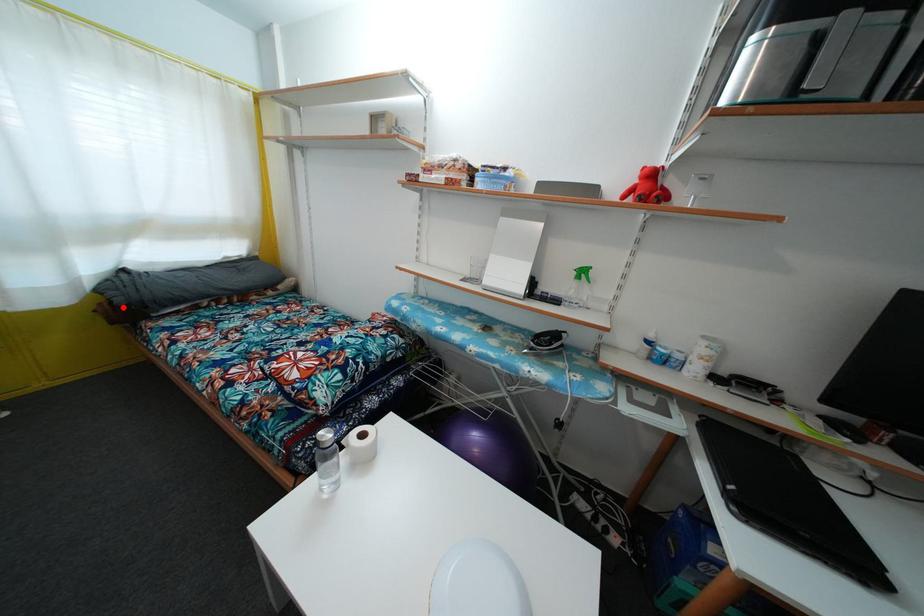
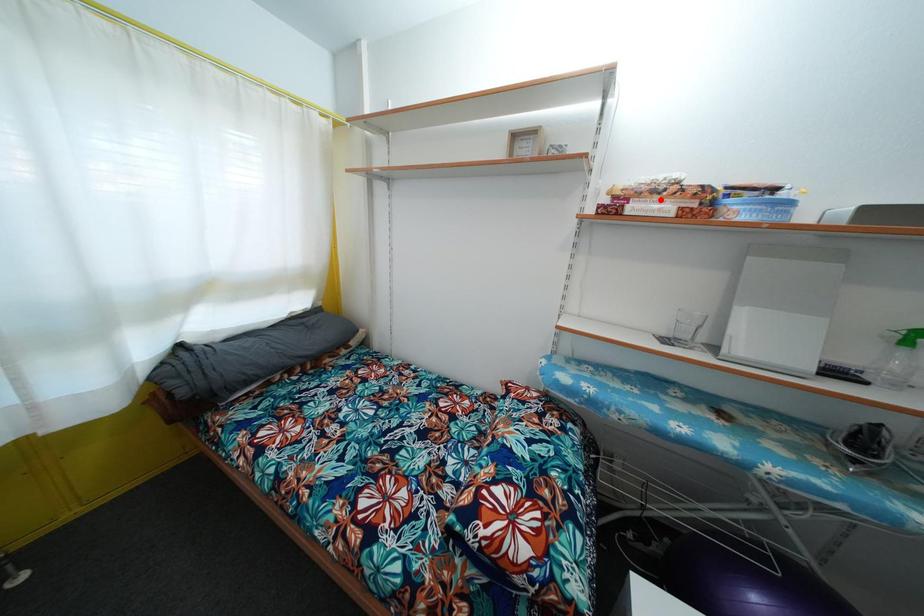
I am providing you with two images of the same scene from different viewpoints. A red point is marked on the first image and another point is marked on the second image. Are the points marked in image1 and image2 representing the same 3D position?

No